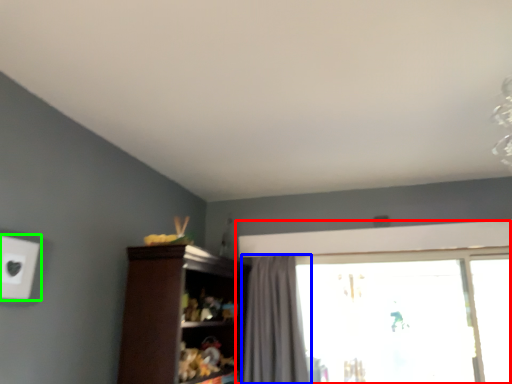
Question: Based on their relative distances, which object is farther from window (highlighted by a red box)? Choose from curtain (highlighted by a blue box) and electric outlet (highlighted by a green box).

Choices:
 (A) curtain
 (B) electric outlet

Answer: (B)